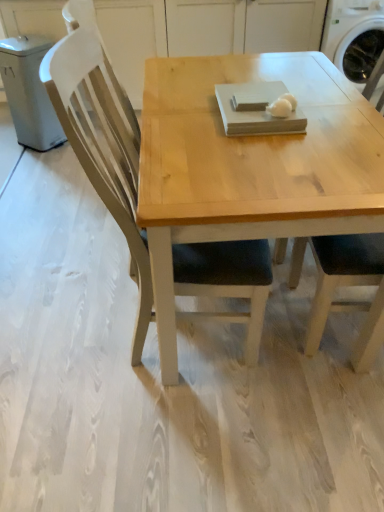
Question: Considering their positions, is white plastic washing machine at upper right located in front of or behind matte wood chair at right?

Choices:
 (A) behind
 (B) front

Answer: (A)

Question: Looking at their shapes, would you say white plastic washing machine at upper right is wider or thinner than matte wood chair at right?

Choices:
 (A) thin
 (B) wide

Answer: (B)

Question: Which is farther from the white matte egg at center?

Choices:
 (A) matte wood chair at right
 (B) white plastic washing machine at upper right

Answer: (B)

Question: Estimate the real-world distances between objects in this image. Which object is closer to the matte wood chair at right?

Choices:
 (A) white plastic washing machine at upper right
 (B) white matte egg at center

Answer: (B)